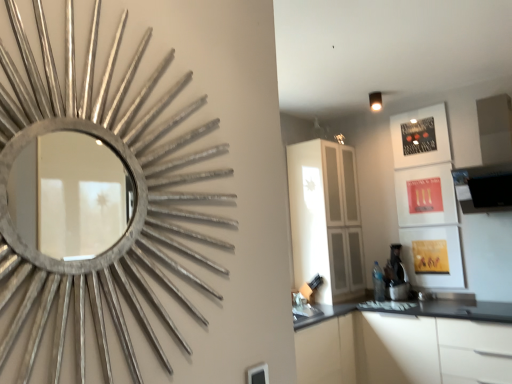
Question: Is white matte cabinet at lower right directly adjacent to white glossy cabinet at center?

Choices:
 (A) no
 (B) yes

Answer: (A)

Question: Can you confirm if white matte cabinet at lower right is smaller than white glossy cabinet at center?

Choices:
 (A) yes
 (B) no

Answer: (B)

Question: From a real-world perspective, is white matte cabinet at lower right physically below white glossy cabinet at center?

Choices:
 (A) no
 (B) yes

Answer: (B)

Question: From the image's perspective, is white matte cabinet at lower right under white glossy cabinet at center?

Choices:
 (A) no
 (B) yes

Answer: (B)

Question: Can you confirm if white matte cabinet at lower right is shorter than white glossy cabinet at center?

Choices:
 (A) yes
 (B) no

Answer: (A)

Question: Is white matte cabinet at lower right further to the viewer compared to white glossy cabinet at center?

Choices:
 (A) yes
 (B) no

Answer: (B)

Question: Are white matte cabinet at lower right and silver metallic mirror at upper left far apart?

Choices:
 (A) no
 (B) yes

Answer: (B)

Question: From a real-world perspective, is white matte cabinet at lower right physically above silver metallic mirror at upper left?

Choices:
 (A) yes
 (B) no

Answer: (B)

Question: Considering the relative positions of white matte cabinet at lower right and silver metallic mirror at upper left in the image provided, is white matte cabinet at lower right behind silver metallic mirror at upper left?

Choices:
 (A) yes
 (B) no

Answer: (A)

Question: From a real-world perspective, is white matte cabinet at lower right located beneath silver metallic mirror at upper left?

Choices:
 (A) no
 (B) yes

Answer: (B)

Question: From the image's perspective, is white matte cabinet at lower right on top of silver metallic mirror at upper left?

Choices:
 (A) yes
 (B) no

Answer: (B)

Question: Is white matte cabinet at lower right not inside silver metallic mirror at upper left?

Choices:
 (A) no
 (B) yes

Answer: (B)

Question: From a real-world perspective, is white glossy cabinet at center on top of silver metallic mirror at upper left?

Choices:
 (A) no
 (B) yes

Answer: (A)